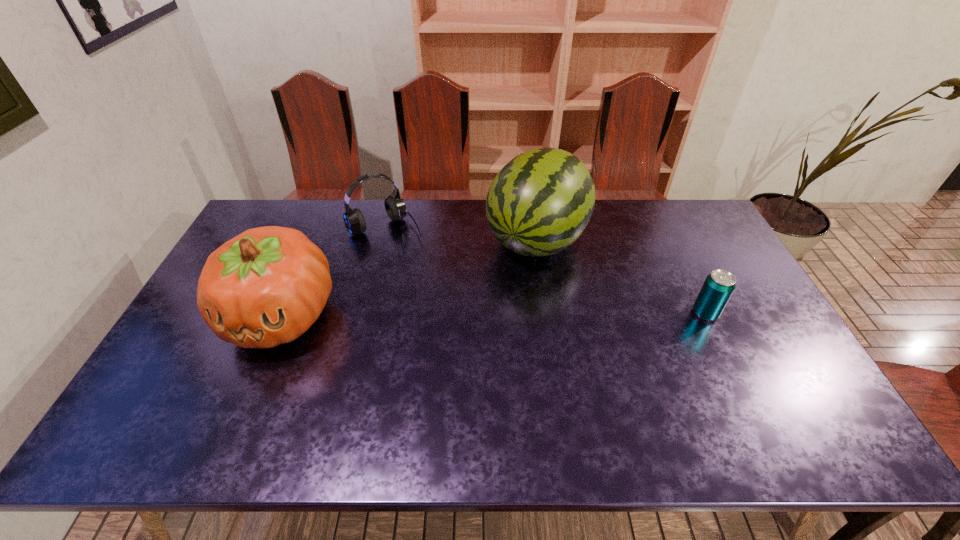
The image size is (960, 540). I want to click on free area in between the shortest object and the pumpkin, so click(x=493, y=314).

Locate an element on the screen. free space between the shortest object and the pumpkin is located at coordinates (493, 314).

Locate an element on the screen. unoccupied area between the headset and the shortest object is located at coordinates (545, 270).

Where is `object that is the second closest to the shortest object`? object that is the second closest to the shortest object is located at coordinates (395, 207).

Identify the location of object that is the second closest to the second shortest object. point(539,203).